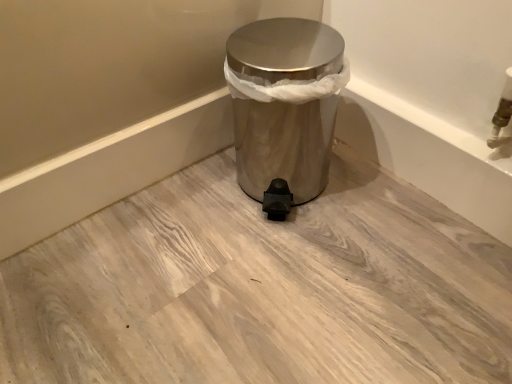
The height and width of the screenshot is (384, 512). Identify the location of vacant area located to the right-hand side of polished stainless steel trash can at center. pyautogui.click(x=391, y=194).